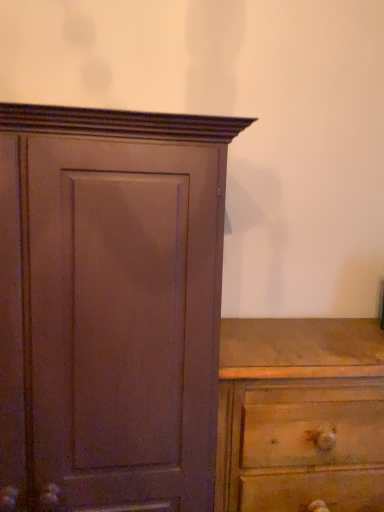
At what (x,y) coordinates should I click in order to perform the action: click on free space above wooden chest of drawers at lower right (from a real-world perspective). Please return your answer as a coordinate pair (x, y). Looking at the image, I should click on (305, 340).